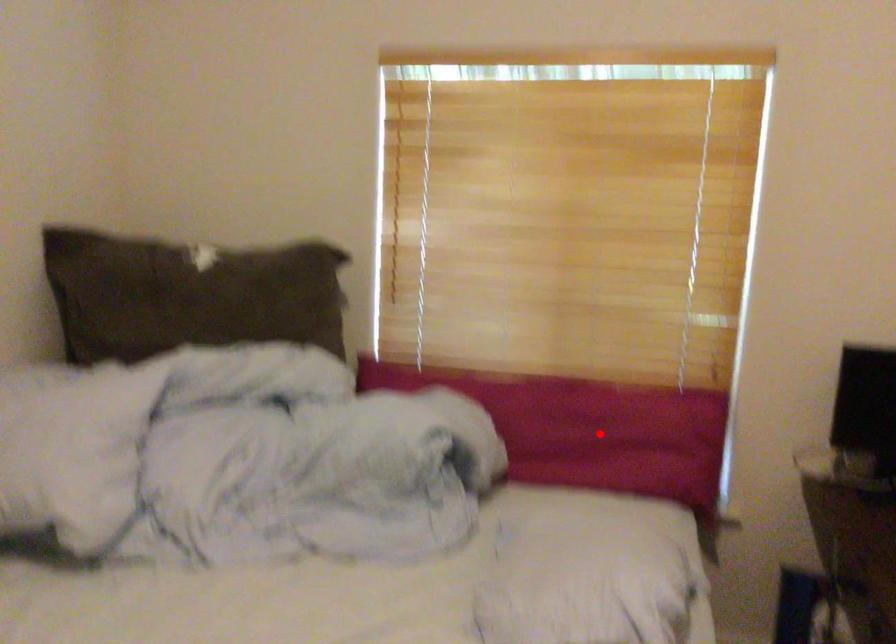
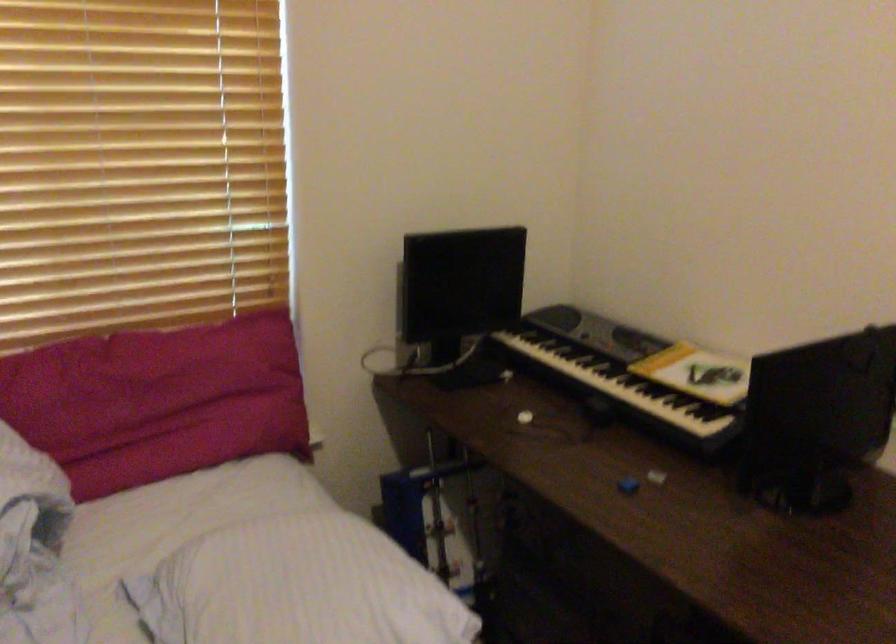
Question: I am providing you with two images of the same scene from different viewpoints. Given a red point in image1, look at the same physical point in image2. Is it:

Choices:
 (A) Closer to the viewpoint
 (B) Farther from the viewpoint

Answer: (A)